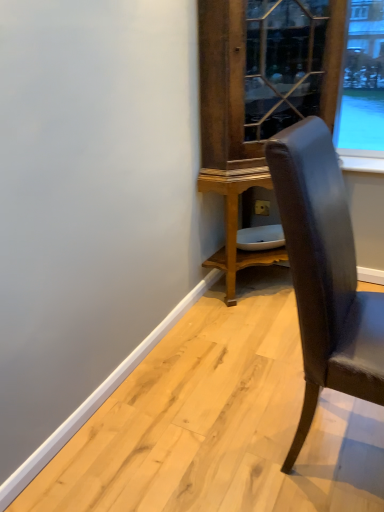
Question: Is leather chair at right to the left of wooden glossy dresser at center from the viewer's perspective?

Choices:
 (A) yes
 (B) no

Answer: (B)

Question: Is leather chair at right directly adjacent to wooden glossy dresser at center?

Choices:
 (A) yes
 (B) no

Answer: (B)

Question: From the image's perspective, is leather chair at right on wooden glossy dresser at center?

Choices:
 (A) no
 (B) yes

Answer: (A)

Question: Considering the relative sizes of leather chair at right and wooden glossy dresser at center in the image provided, is leather chair at right wider than wooden glossy dresser at center?

Choices:
 (A) no
 (B) yes

Answer: (A)

Question: Does leather chair at right come behind wooden glossy dresser at center?

Choices:
 (A) no
 (B) yes

Answer: (A)

Question: Does leather chair at right lie in front of wooden glossy dresser at center?

Choices:
 (A) no
 (B) yes

Answer: (B)

Question: Can you confirm if wooden glossy dresser at center is positioned to the left of leather chair at right?

Choices:
 (A) yes
 (B) no

Answer: (A)

Question: Is the position of wooden glossy dresser at center more distant than that of leather chair at right?

Choices:
 (A) no
 (B) yes

Answer: (B)

Question: From the image's perspective, is wooden glossy dresser at center on leather chair at right?

Choices:
 (A) yes
 (B) no

Answer: (A)

Question: Is wooden glossy dresser at center directly adjacent to leather chair at right?

Choices:
 (A) no
 (B) yes

Answer: (A)

Question: Considering the relative positions of wooden glossy dresser at center and leather chair at right in the image provided, is wooden glossy dresser at center to the right of leather chair at right from the viewer's perspective?

Choices:
 (A) no
 (B) yes

Answer: (A)

Question: Is wooden glossy dresser at center looking in the opposite direction of leather chair at right?

Choices:
 (A) yes
 (B) no

Answer: (B)

Question: Is point (301, 162) positioned closer to the camera than point (246, 20)?

Choices:
 (A) closer
 (B) farther

Answer: (A)